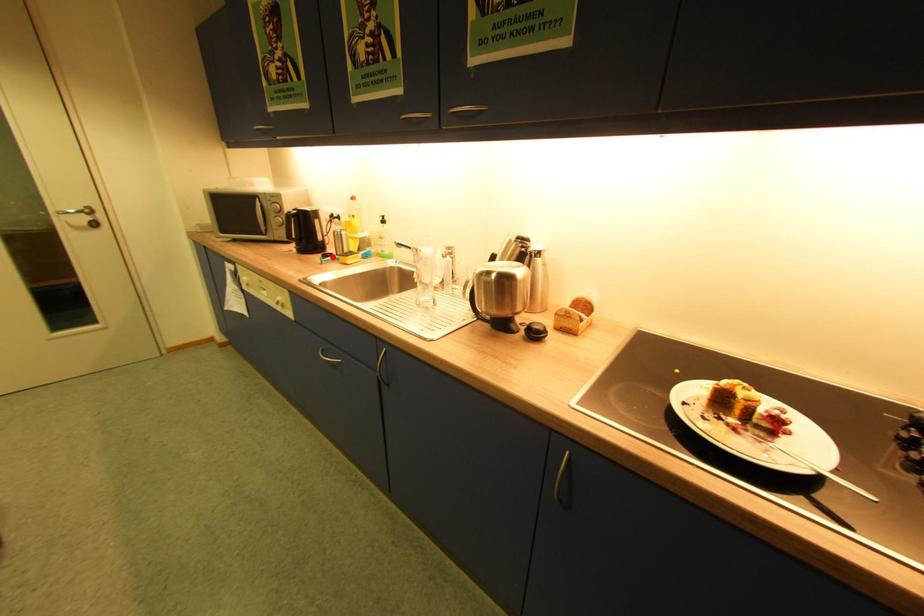
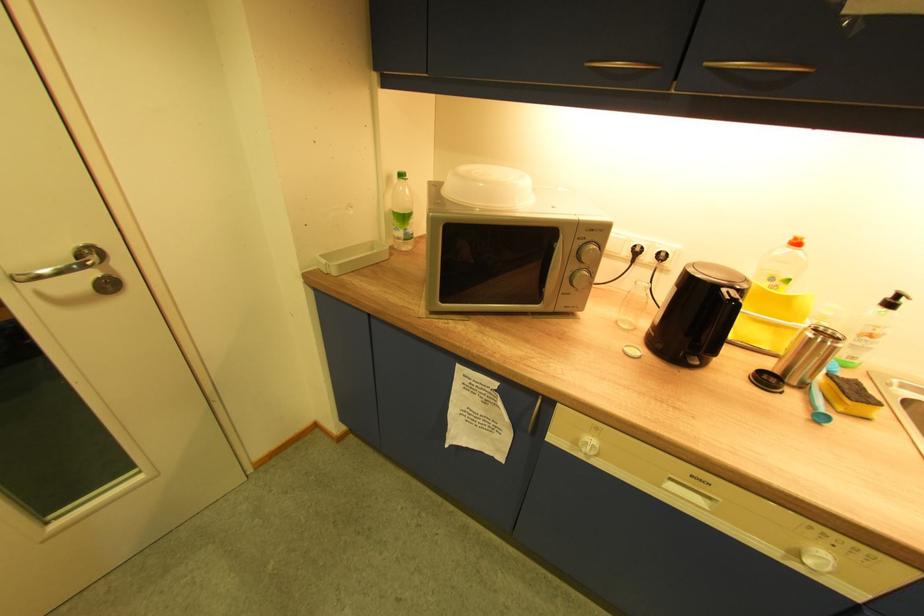
The point at the highlighted location is marked in the first image. Where is the corresponding point in the second image?

(772, 382)